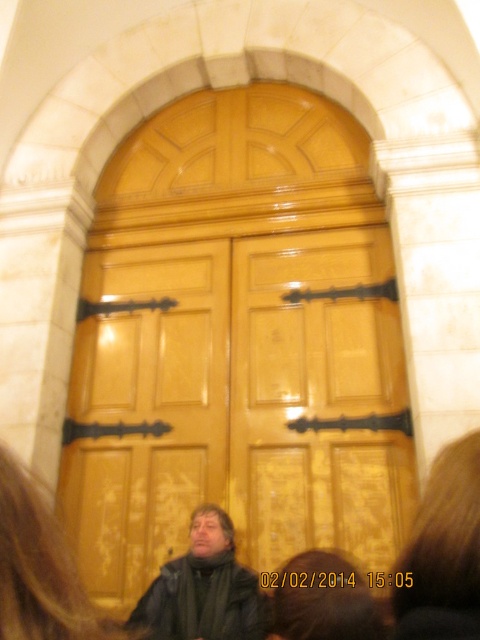
Question: Which point is farther to the camera?

Choices:
 (A) dark brown leather jacket at center
 (B) glossy wood door at center

Answer: (B)

Question: Among these points, which one is farthest from the camera?

Choices:
 (A) (176, 609)
 (B) (397, 412)

Answer: (B)

Question: Is glossy wood door at center smaller than dark brown leather jacket at center?

Choices:
 (A) yes
 (B) no

Answer: (B)

Question: Is glossy wood door at center positioned in front of dark brown leather jacket at center?

Choices:
 (A) no
 (B) yes

Answer: (A)

Question: Does glossy wood door at center have a lesser width compared to dark brown leather jacket at center?

Choices:
 (A) yes
 (B) no

Answer: (B)

Question: Which point is farther to the camera?

Choices:
 (A) (228, 468)
 (B) (157, 577)

Answer: (A)